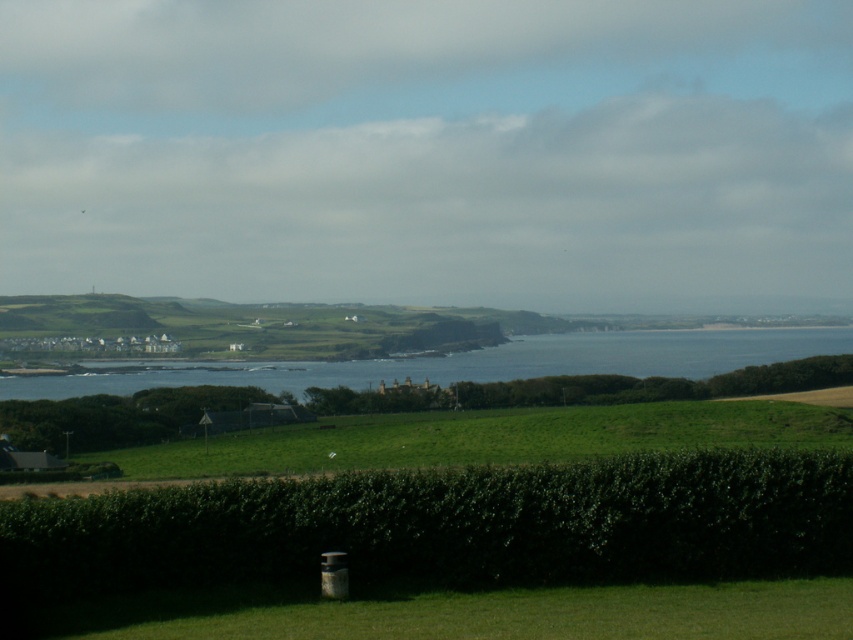
You are standing at the viewpoint overlooking the coastal landscape. There is a point marked at coordinates point (651, 520). If you want to place a 25 meter long safety rope from your current position to that point, will the rope be sufficient?

The point (651, 520) is 23.88 meters from the viewer. Since the rope is 25 meters long, it will be sufficient to reach the point.